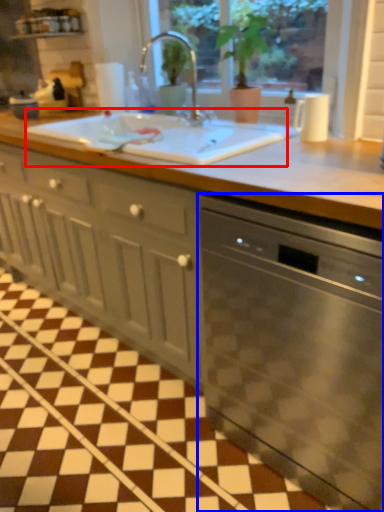
Question: Among these objects, which one is farthest to the camera, sink (highlighted by a red box) or home appliance (highlighted by a blue box)?

Choices:
 (A) sink
 (B) home appliance

Answer: (A)